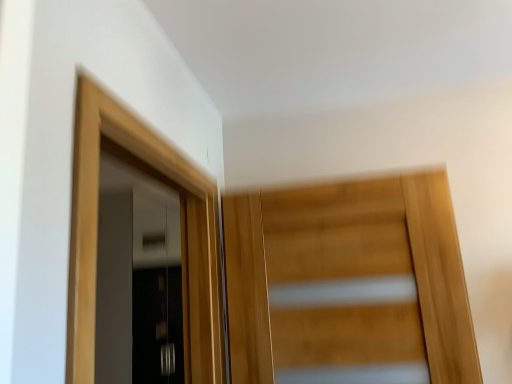
Question: Considering the relative sizes of matte black door at left, which is the third door from front to back, and light wood door at upper left, marked as the 2th door in a right-to-left arrangement, in the image provided, is matte black door at left, which is the third door from front to back, thinner than light wood door at upper left, marked as the 2th door in a right-to-left arrangement,?

Choices:
 (A) no
 (B) yes

Answer: (A)

Question: From the image's perspective, is matte black door at left, the 1th door when ordered from left to right, under light wood door at upper left, the 1th door viewed from the front?

Choices:
 (A) no
 (B) yes

Answer: (B)

Question: Does matte black door at left, the 1th door when ordered from left to right, have a larger size compared to light wood door at upper left, which is the 2th door from left to right?

Choices:
 (A) no
 (B) yes

Answer: (B)

Question: Considering the relative sizes of matte black door at left, which ranks as the first door in back-to-front order, and light wood door at upper left, the 1th door viewed from the front, in the image provided, is matte black door at left, which ranks as the first door in back-to-front order, smaller than light wood door at upper left, the 1th door viewed from the front,?

Choices:
 (A) yes
 (B) no

Answer: (B)

Question: Does matte black door at left, which is the third door from front to back, lie behind light wood door at upper left, which appears as the 3th door when viewed from the back?

Choices:
 (A) yes
 (B) no

Answer: (A)

Question: From a real-world perspective, is matte black door at left, which ranks as the first door in back-to-front order, beneath light wood door at upper left, which is the 2th door from left to right?

Choices:
 (A) yes
 (B) no

Answer: (A)

Question: Is light wood door at upper left, which is the 2th door from left to right, positioned before matte black door at left, the 1th door when ordered from left to right?

Choices:
 (A) yes
 (B) no

Answer: (A)

Question: Is light wood door at upper left, which appears as the 3th door when viewed from the back, oriented away from matte black door at left, which is the third door from front to back?

Choices:
 (A) yes
 (B) no

Answer: (B)

Question: Is light wood door at upper left, which appears as the 3th door when viewed from the back, bigger than matte black door at left, which is the third door from front to back?

Choices:
 (A) no
 (B) yes

Answer: (A)

Question: Can you confirm if light wood door at upper left, which is the 2th door from left to right, is wider than matte black door at left, which is the third door from front to back?

Choices:
 (A) yes
 (B) no

Answer: (B)

Question: Is light wood door at upper left, which appears as the 3th door when viewed from the back, outside matte black door at left, which ranks as the first door in back-to-front order?

Choices:
 (A) yes
 (B) no

Answer: (A)

Question: Does light wood door at upper left, marked as the 2th door in a right-to-left arrangement, appear on the left side of matte black door at left, the 1th door when ordered from left to right?

Choices:
 (A) yes
 (B) no

Answer: (B)

Question: Can we say wooden door at center, the 3th door viewed from the left, lies outside matte black door at left, which is the third door from front to back?

Choices:
 (A) yes
 (B) no

Answer: (A)